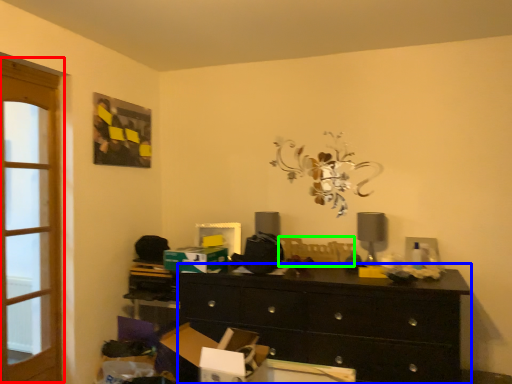
Question: Which is farther away from screen door (highlighted by a red box)? chest of drawers (highlighted by a blue box) or swivel chair (highlighted by a green box)?

Choices:
 (A) chest of drawers
 (B) swivel chair

Answer: (B)